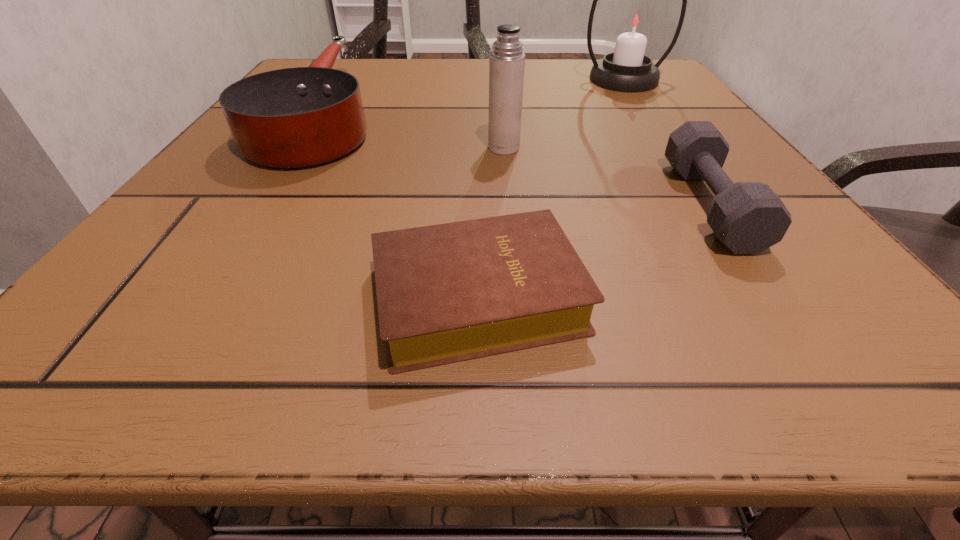
Locate an element on the screen. free space between the tallest object and the pan is located at coordinates (473, 97).

Identify the location of blank region between the dumbbell and the pan. click(x=516, y=159).

This screenshot has height=540, width=960. I want to click on free spot between the leftmost object and the second shortest object, so click(516, 159).

Locate an element on the screen. free space that is in between the dumbbell and the shortest object is located at coordinates (593, 251).

At what (x,y) coordinates should I click in order to perform the action: click on object that stands as the third closest to the shortest object. Please return your answer as a coordinate pair (x, y). Looking at the image, I should click on (507, 61).

I want to click on object that ranks as the third closest to the dumbbell, so click(635, 22).

In order to click on blank area in the image that satisfies the following two spatial constraints: 1. on the back side of the fourth tallest object; 2. on the left side of the Bible in this screenshot , I will do `click(478, 204)`.

This screenshot has height=540, width=960. I want to click on free space that satisfies the following two spatial constraints: 1. on the back side of the shortest object; 2. on the right side of the thermos bottle, so click(479, 147).